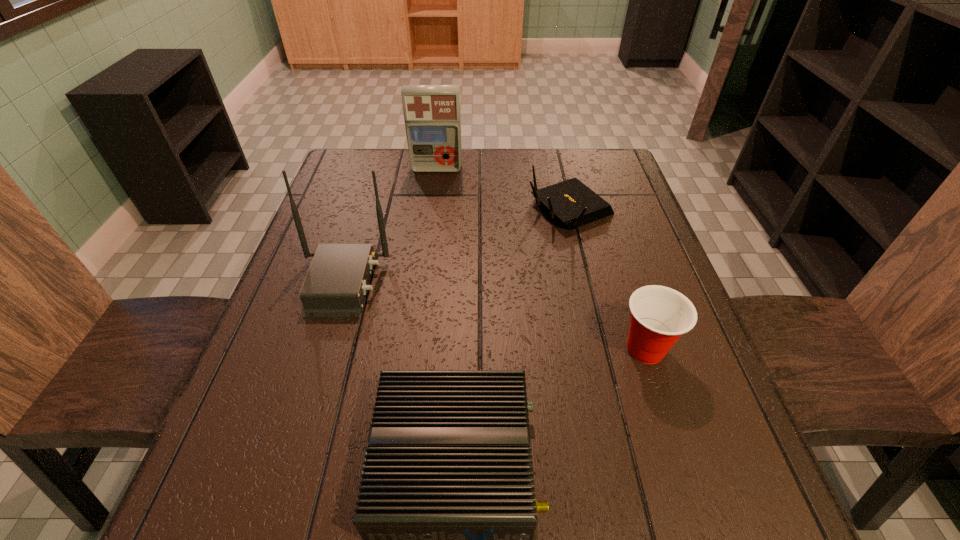
Where is `vacant position located on the left of the rightmost router`? vacant position located on the left of the rightmost router is located at coordinates (392, 210).

Locate an element on the screen. This screenshot has width=960, height=540. the first-aid kit present at the far edge is located at coordinates (432, 116).

The image size is (960, 540). Identify the location of router located in the far edge section of the desktop. (572, 203).

Identify the location of object that is at the left edge. The image size is (960, 540). (335, 286).

Locate an element on the screen. cup that is at the right edge is located at coordinates (659, 315).

Locate an element on the screen. router located in the right edge section of the desktop is located at coordinates (572, 203).

Where is `object located in the far right corner section of the desktop`? object located in the far right corner section of the desktop is located at coordinates (572, 203).

I want to click on free space at the far edge of the desktop, so click(494, 186).

This screenshot has width=960, height=540. I want to click on free location at the near edge of the desktop, so click(326, 515).

What are the coordinates of `blank space at the left edge of the desktop` in the screenshot? It's located at (329, 350).